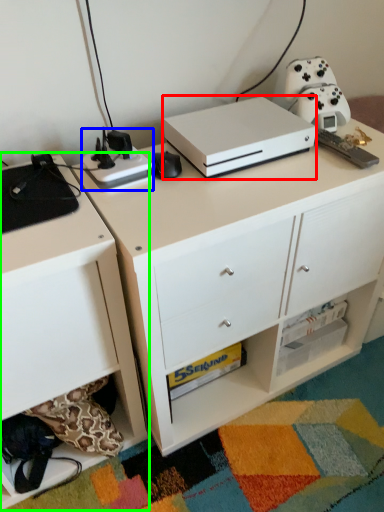
Question: Which object is positioned closest to appliance (highlighted by a red box)? Select from appliance (highlighted by a blue box) and chest of drawers (highlighted by a green box).

Choices:
 (A) appliance
 (B) chest of drawers

Answer: (A)